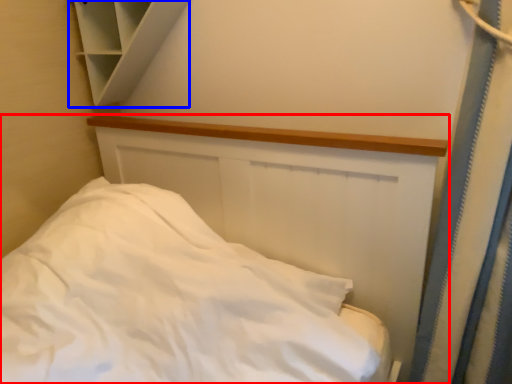
Question: Among these objects, which one is farthest to the camera, bed (highlighted by a red box) or cabinet (highlighted by a blue box)?

Choices:
 (A) bed
 (B) cabinet

Answer: (B)